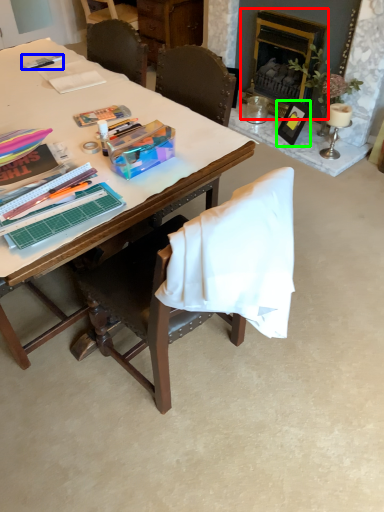
Question: Considering the real-world distances, which object is closest to fireplace (highlighted by a red box)? pen (highlighted by a blue box) or picture frame (highlighted by a green box).

Choices:
 (A) pen
 (B) picture frame

Answer: (B)